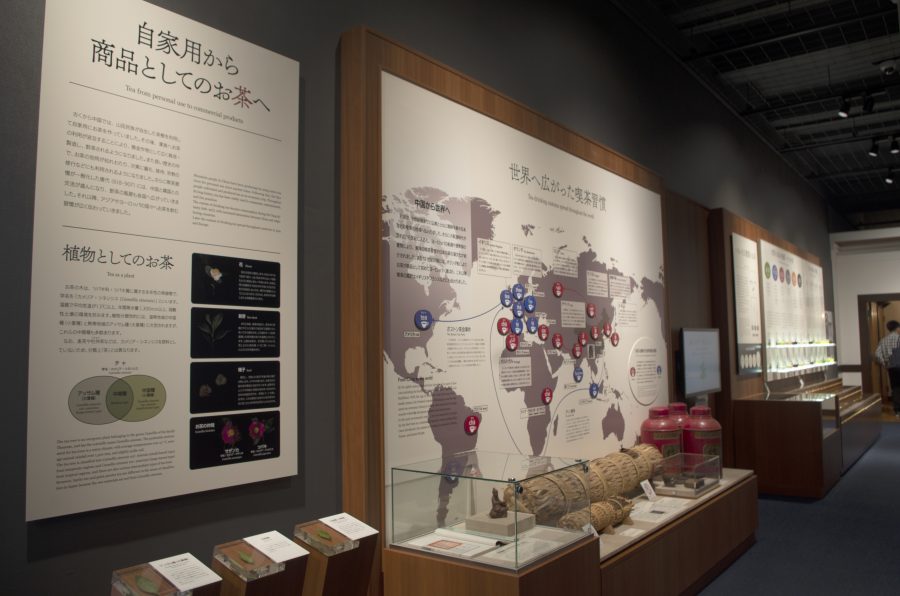
Find the location of `jugs`. jugs is located at coordinates (658, 434), (679, 429), (704, 437).